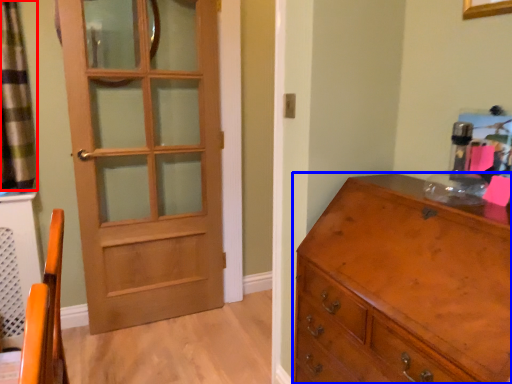
Question: Which point is closer to the camera, curtain (highlighted by a red box) or chest of drawers (highlighted by a blue box)?

Choices:
 (A) curtain
 (B) chest of drawers

Answer: (B)